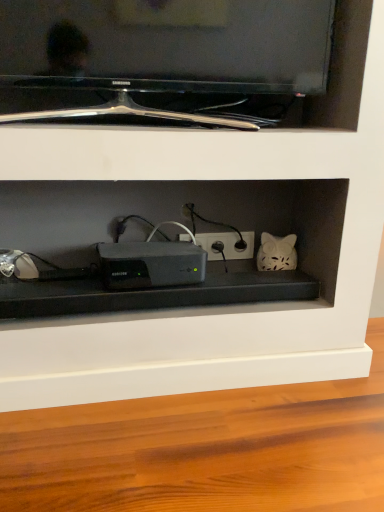
Locate an element on the screen. This screenshot has height=512, width=384. black glossy tv at upper center is located at coordinates [x=162, y=60].

What do you see at coordinates (151, 264) in the screenshot? I see `sleek black device at center` at bounding box center [151, 264].

The width and height of the screenshot is (384, 512). I want to click on white plastic electric outlet at center, so [x=227, y=245].

Where is `white matte cat at center-right`? white matte cat at center-right is located at coordinates (276, 253).

Who is shorter, sleek black device at center or black glossy tv at upper center?

sleek black device at center is shorter.

Would you consider sleek black device at center to be distant from black glossy tv at upper center?

sleek black device at center is actually quite close to black glossy tv at upper center.

Is sleek black device at center smaller than black glossy tv at upper center?

Yes, sleek black device at center is smaller than black glossy tv at upper center.

Which object is positioned more to the left, white matte cat at center-right or white plastic electric outlet at center?

white plastic electric outlet at center is more to the left.

Is white matte cat at center-right turned away from white plastic electric outlet at center?

No, white matte cat at center-right is not facing the opposite direction of white plastic electric outlet at center.

Is white plastic electric outlet at center located within white matte cat at center-right?

Actually, white plastic electric outlet at center is outside white matte cat at center-right.

Locate an element on the screen. Image resolution: width=384 pixels, height=512 pixels. cat below the white plastic electric outlet at center (from the image's perspective) is located at coordinates (276, 253).

Between black glossy tv at upper center and white matte cat at center-right, which one has less height?

Standing shorter between the two is white matte cat at center-right.

Consider the image. Considering the positions of objects black glossy tv at upper center and white matte cat at center-right in the image provided, who is behind, black glossy tv at upper center or white matte cat at center-right?

white matte cat at center-right is further from the camera.

Is black glossy tv at upper center oriented away from white matte cat at center-right?

black glossy tv at upper center does not have its back to white matte cat at center-right.

From the image's perspective, which is above, black glossy tv at upper center or white matte cat at center-right?

From the image's view, black glossy tv at upper center is above.

From the image's perspective, is black glossy tv at upper center under white plastic electric outlet at center?

Incorrect, from the image's perspective, black glossy tv at upper center is higher than white plastic electric outlet at center.

Could white plastic electric outlet at center be considered to be inside black glossy tv at upper center?

No, white plastic electric outlet at center is not inside black glossy tv at upper center.

Is black glossy tv at upper center with white plastic electric outlet at center?

No, black glossy tv at upper center is not with white plastic electric outlet at center.

From the picture: Between black glossy tv at upper center and white plastic electric outlet at center, which one is positioned behind?

white plastic electric outlet at center is behind.

Consider the image. Does black glossy tv at upper center have a lesser width compared to sleek black device at center?

Correct, the width of black glossy tv at upper center is less than that of sleek black device at center.

Where is `appliance behind the black glossy tv at upper center`? The height and width of the screenshot is (512, 384). appliance behind the black glossy tv at upper center is located at coordinates 151,264.

Can you tell me how much black glossy tv at upper center and sleek black device at center differ in facing direction?

The facing directions of black glossy tv at upper center and sleek black device at center are 6.37 degrees apart.

Looking at this image, from the image's perspective, which one is positioned lower, black glossy tv at upper center or sleek black device at center?

sleek black device at center.

Does white matte cat at center-right have a smaller size compared to sleek black device at center?

Indeed, white matte cat at center-right has a smaller size compared to sleek black device at center.

Is white matte cat at center-right at the right side of sleek black device at center?

Yes.

Could you tell me if white matte cat at center-right is turned towards sleek black device at center?

No, white matte cat at center-right is not aimed at sleek black device at center.

Is white matte cat at center-right facing towards black glossy tv at upper center?

No, white matte cat at center-right is not facing towards black glossy tv at upper center.

Looking at the image, does white matte cat at center-right seem bigger or smaller compared to black glossy tv at upper center?

In the image, white matte cat at center-right appears to be smaller than black glossy tv at upper center.

Looking at this image, considering their positions, is white matte cat at center-right located in front of or behind black glossy tv at upper center?

In the image, white matte cat at center-right appears behind black glossy tv at upper center.

Which is correct: white matte cat at center-right is inside black glossy tv at upper center, or outside of it?

white matte cat at center-right cannot be found inside black glossy tv at upper center.

Find the location of a particular element. This screenshot has height=512, width=384. appliance that appears below the black glossy tv at upper center (from the image's perspective) is located at coordinates (151, 264).

At what (x,y) coordinates should I click in order to perform the action: click on cat in front of the white plastic electric outlet at center. Please return your answer as a coordinate pair (x, y). Looking at the image, I should click on (276, 253).

From the image, which object appears to be nearer to black glossy tv at upper center, white plastic electric outlet at center or sleek black device at center?

sleek black device at center lies closer to black glossy tv at upper center than the other object.

Based on their spatial positions, is white matte cat at center-right or black glossy tv at upper center further from white plastic electric outlet at center?

The object further to white plastic electric outlet at center is black glossy tv at upper center.

From the image, which object appears to be nearer to sleek black device at center, white matte cat at center-right or white plastic electric outlet at center?

Based on the image, white plastic electric outlet at center appears to be nearer to sleek black device at center.

Looking at the image, which one is located closer to sleek black device at center, white plastic electric outlet at center or white matte cat at center-right?

white plastic electric outlet at center.

From the image, which object appears to be nearer to white matte cat at center-right, sleek black device at center or black glossy tv at upper center?

sleek black device at center lies closer to white matte cat at center-right than the other object.

In the scene shown: From the image, which object appears to be nearer to sleek black device at center, black glossy tv at upper center or white plastic electric outlet at center?

white plastic electric outlet at center is positioned closer to the anchor sleek black device at center.

Based on their spatial positions, is sleek black device at center or white plastic electric outlet at center closer to black glossy tv at upper center?

sleek black device at center lies closer to black glossy tv at upper center than the other object.

Consider the image. Which object lies further to the anchor point white plastic electric outlet at center, sleek black device at center or white matte cat at center-right?

sleek black device at center is positioned further to the anchor white plastic electric outlet at center.

Where is `appliance positioned between black glossy tv at upper center and white plastic electric outlet at center from near to far`? This screenshot has height=512, width=384. appliance positioned between black glossy tv at upper center and white plastic electric outlet at center from near to far is located at coordinates (151, 264).

Image resolution: width=384 pixels, height=512 pixels. I want to click on electric outlet located between sleek black device at center and white matte cat at center-right in the left-right direction, so click(x=227, y=245).

I want to click on cat between black glossy tv at upper center and white plastic electric outlet at center in the front-back direction, so 276,253.

Identify the location of cat that lies between black glossy tv at upper center and sleek black device at center from top to bottom. This screenshot has width=384, height=512. (276, 253).